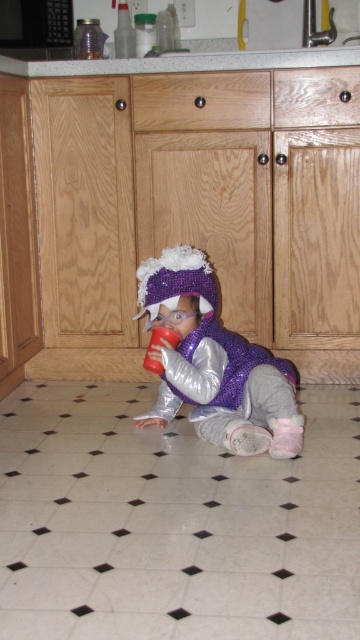
Does sparkly purple vest at center have a larger size compared to granite countertop at upper center?

No.

Between point (268, 378) and point (285, 65), which one is positioned in front?

Positioned in front is point (268, 378).

Find the location of a particular element. This screenshot has width=360, height=640. sparkly purple vest at center is located at coordinates (214, 364).